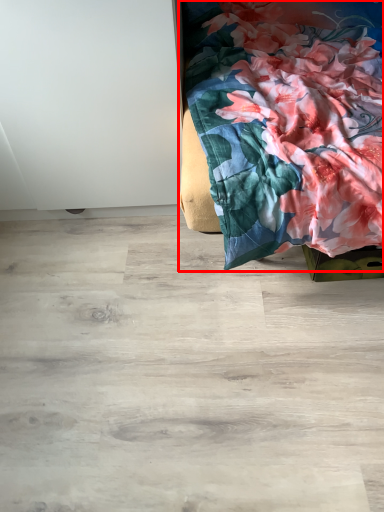
Question: Considering the relative positions of furniture (annotated by the red box) and plywood in the image provided, where is furniture (annotated by the red box) located with respect to the staircase?

Choices:
 (A) left
 (B) right

Answer: (B)